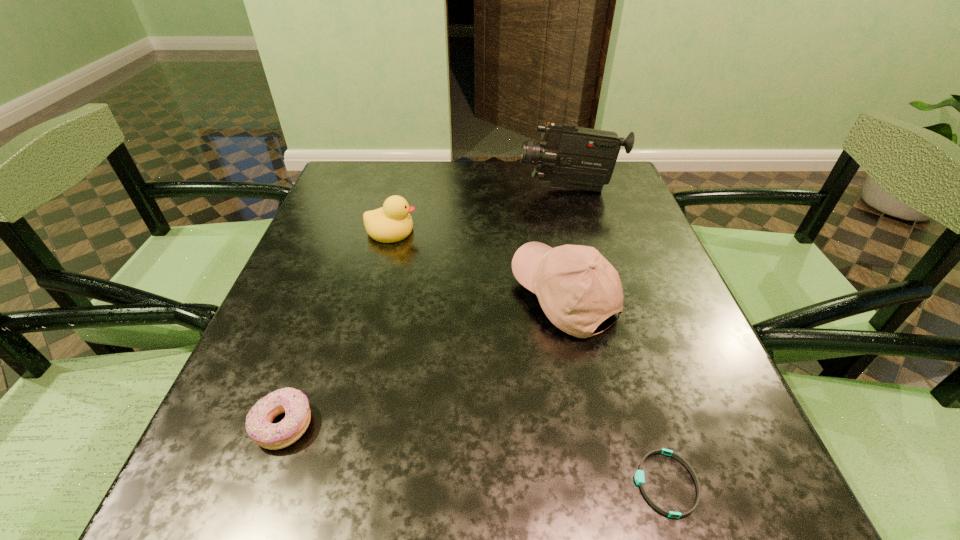
In order to click on vacant space located 0.400m on the front-facing side of the tallest object in this screenshot , I will do `click(368, 189)`.

Identify the location of free space located 0.140m on the front-facing side of the baseball cap. Image resolution: width=960 pixels, height=540 pixels. (442, 297).

This screenshot has width=960, height=540. Find the location of `vacant region located 0.270m on the front-facing side of the baseball cap`. vacant region located 0.270m on the front-facing side of the baseball cap is located at coordinates (375, 297).

The height and width of the screenshot is (540, 960). Find the location of `blank area located on the front-facing side of the baseball cap`. blank area located on the front-facing side of the baseball cap is located at coordinates (482, 297).

Locate an element on the screen. The height and width of the screenshot is (540, 960). vacant point located 0.240m on the face of the third shortest object is located at coordinates (519, 231).

Locate an element on the screen. The height and width of the screenshot is (540, 960). vacant point located 0.310m on the back of the doughnut is located at coordinates (339, 271).

Where is `blank area located on the buckle of the wristband`? blank area located on the buckle of the wristband is located at coordinates (510, 483).

Find the location of a particular element. vacant space located 0.340m on the buckle of the wristband is located at coordinates (385, 483).

Find the location of a particular element. The image size is (960, 540). vacant position located on the buckle of the wristband is located at coordinates (562, 483).

This screenshot has height=540, width=960. Identify the location of object located in the far edge section of the desktop. (572, 157).